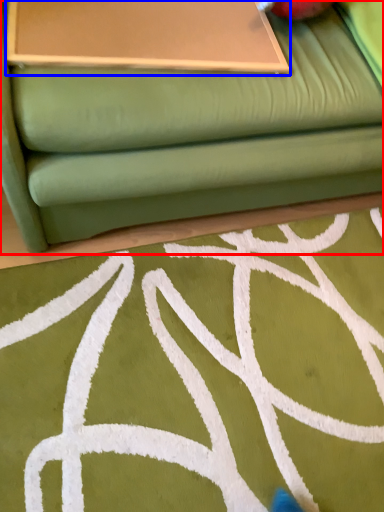
Question: Which of the following is the farthest to the observer, studio couch (highlighted by a red box) or table (highlighted by a blue box)?

Choices:
 (A) studio couch
 (B) table

Answer: (B)